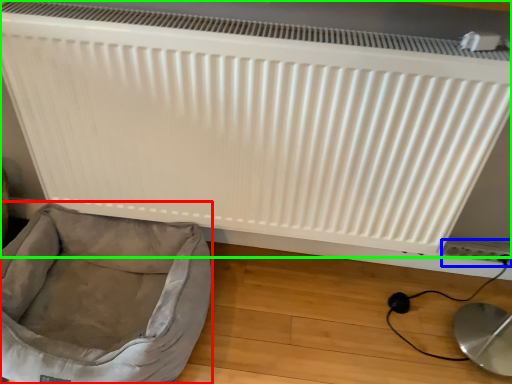
Question: Estimate the real-world distances between objects in this image. Which object is closer to dog bed (highlighted by a red box), electric outlet (highlighted by a blue box) or radiator (highlighted by a green box)?

Choices:
 (A) electric outlet
 (B) radiator

Answer: (B)